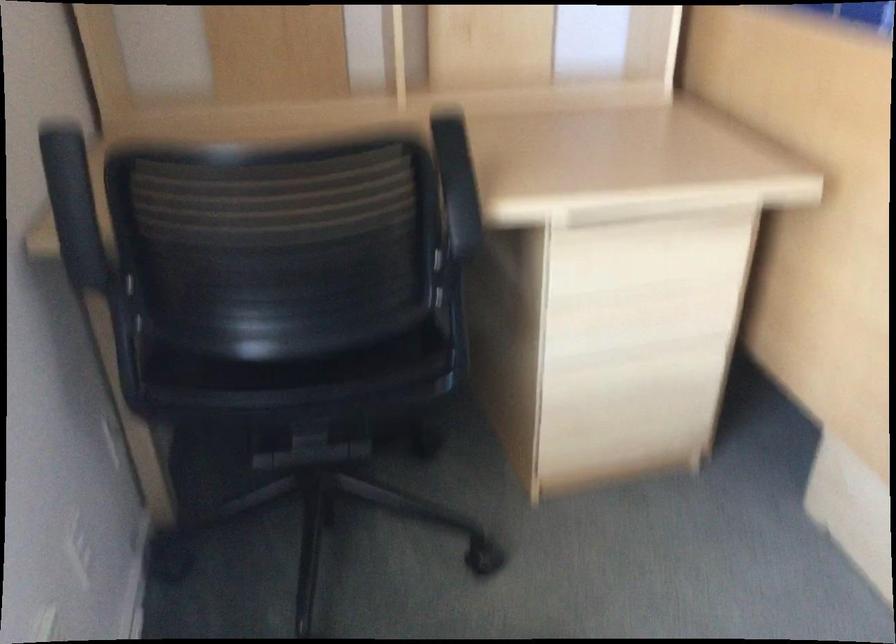
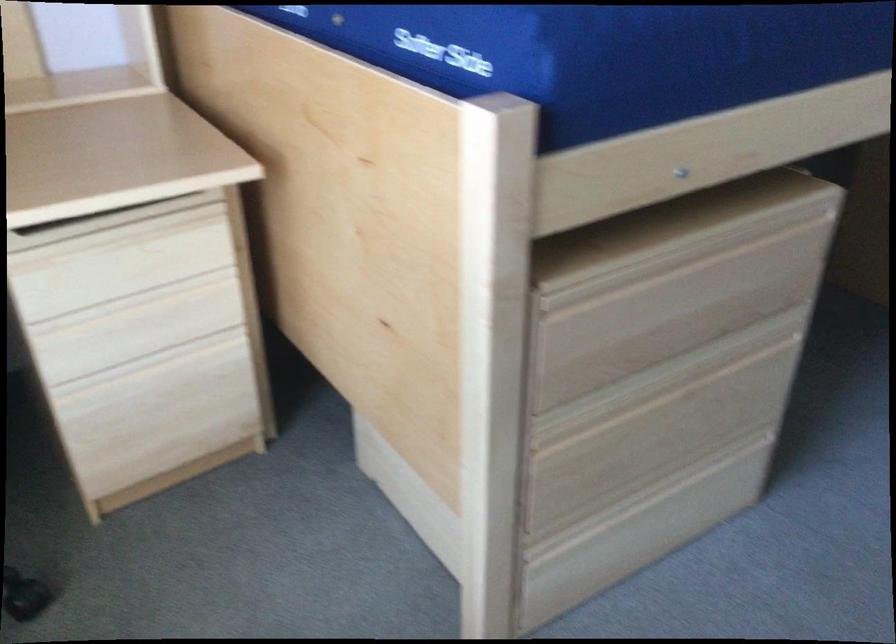
Where in the second image is the point corresponding to point (642, 298) from the first image?

(134, 301)